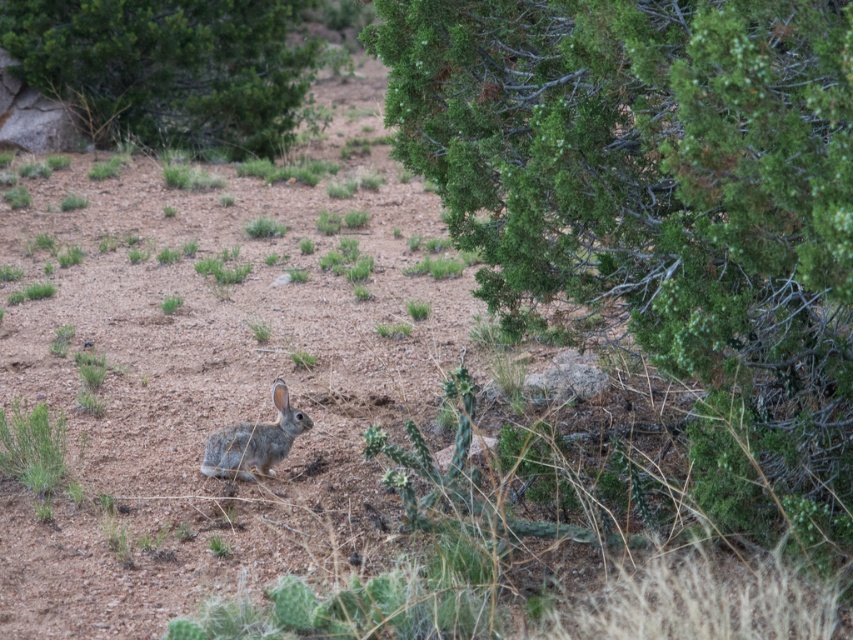
You are standing at the point with coordinates point (x=90, y=131) and want to walk to the point with coordinates point (x=556, y=291). According to the scene description, which direction should you move to reach your destination?

Point (x=556, y=291) is in front of point (x=90, y=131), so you should move forward to reach your destination.

You are a desert explorer who needs to find shade. You see a green leafy tree at upper left and a fuzzy gray rabbit at center. Which object can provide shade?

The green leafy tree at upper left is much taller than the fuzzy gray rabbit at center, so it can provide shade.